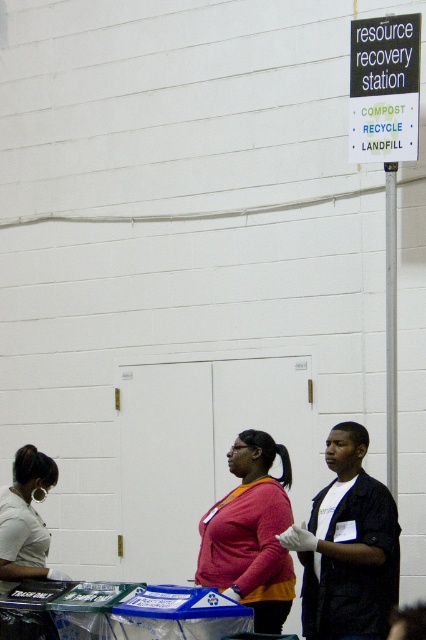
You are a delivery person who needs to place a small package between the matte pink sweater at center and the matte white shirt at lower left. The package is 4 feet long. Will it fit between them?

The distance between the matte pink sweater at center and the matte white shirt at lower left is 3.99 feet. Since the package is 4 feet long, it will not fit between them as it is slightly longer than the available space.